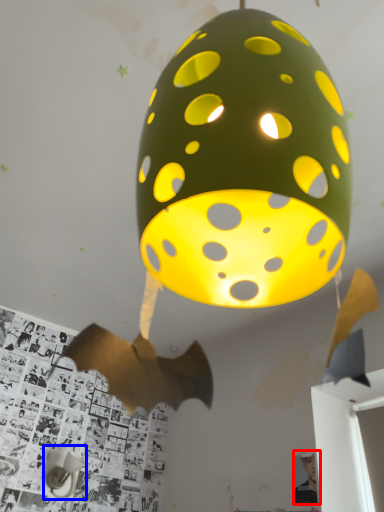
Question: Which object is closer to the camera taking this photo, person (highlighted by a red box) or table lamp (highlighted by a blue box)?

Choices:
 (A) person
 (B) table lamp

Answer: (A)